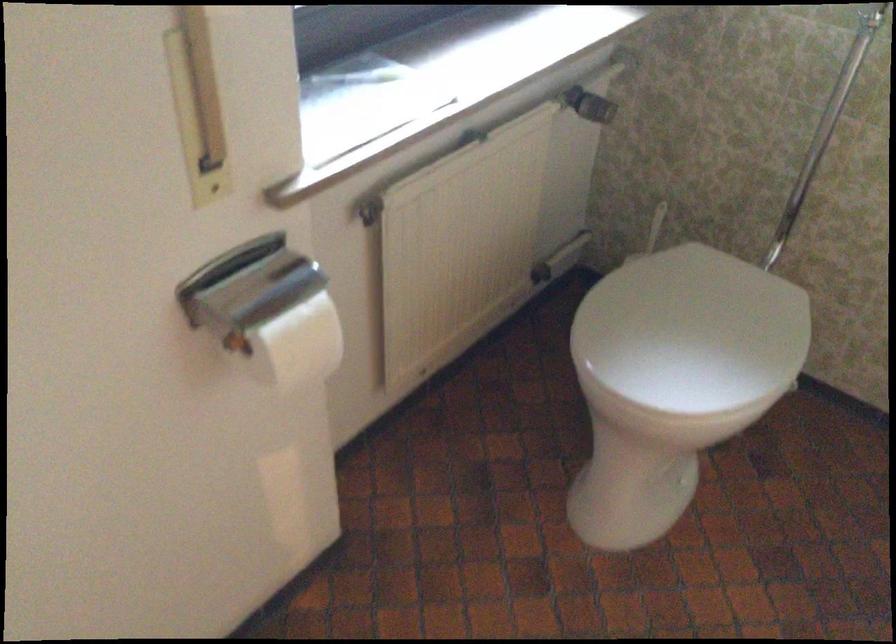
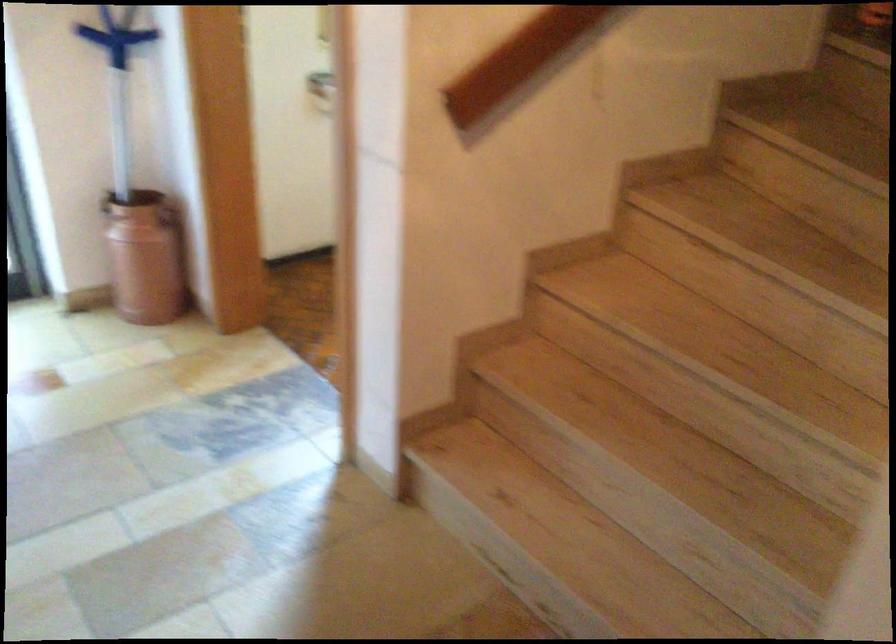
Question: I am providing you with two images of the same scene from different viewpoints. Which of the following objects are not visible in image2?

Choices:
 (A) blue cleaning tool
 (B) toilet lid
 (C) white foldable stool
 (D) wooden stair handrail

Answer: (B)